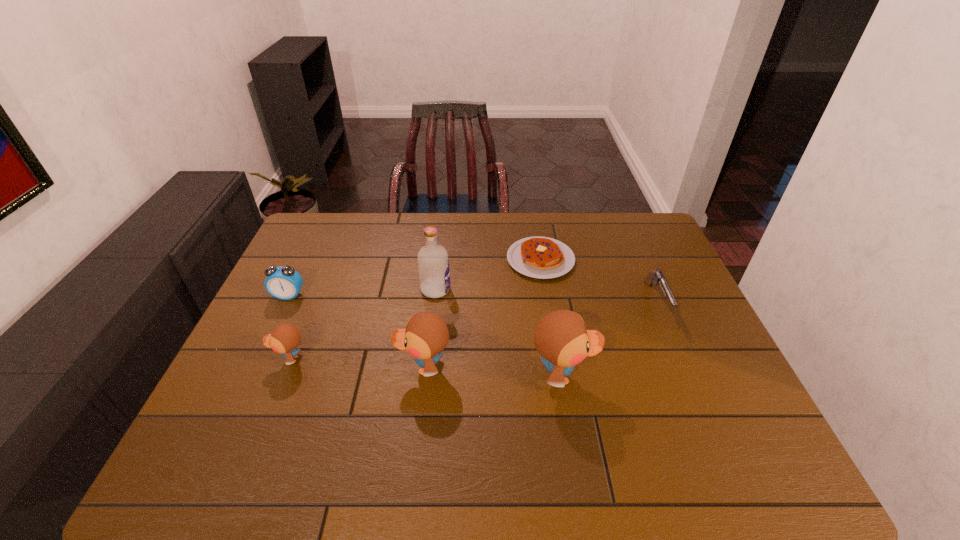
This screenshot has width=960, height=540. Find the location of `the shortest duck`. the shortest duck is located at coordinates [x=285, y=338].

You are a GUI agent. You are given a task and a screenshot of the screen. Output one action in this format:
    pyautogui.click(x=<x>, y=<y>)
    Task: Click on the fifth shortest object
    This screenshot has width=960, height=540.
    Given the screenshot: What is the action you would take?
    coord(426,334)

You are a GUI agent. You are given a task and a screenshot of the screen. Output one action in this format:
    pyautogui.click(x=<x>, y=<y>)
    Task: Click on the second shortest duck
    
    Given the screenshot: What is the action you would take?
    pyautogui.click(x=426, y=334)

At what (x,y) coordinates should I click in order to perform the action: click on the rightmost duck. Please return your answer as a coordinate pair (x, y). Looking at the image, I should click on (561, 338).

This screenshot has height=540, width=960. What are the coordinates of `vodka` in the screenshot? It's located at (433, 264).

Where is `the shortest object`? This screenshot has width=960, height=540. the shortest object is located at coordinates (540, 257).

Image resolution: width=960 pixels, height=540 pixels. Identify the location of the rightmost object. (658, 277).

Locate an element on the screen. This screenshot has width=960, height=540. gun is located at coordinates (658, 277).

The image size is (960, 540). I want to click on alarm clock, so click(283, 282).

Find the location of a particular element. The height and width of the screenshot is (540, 960). free spot located on the front-facing side of the second duck from right to left is located at coordinates (264, 367).